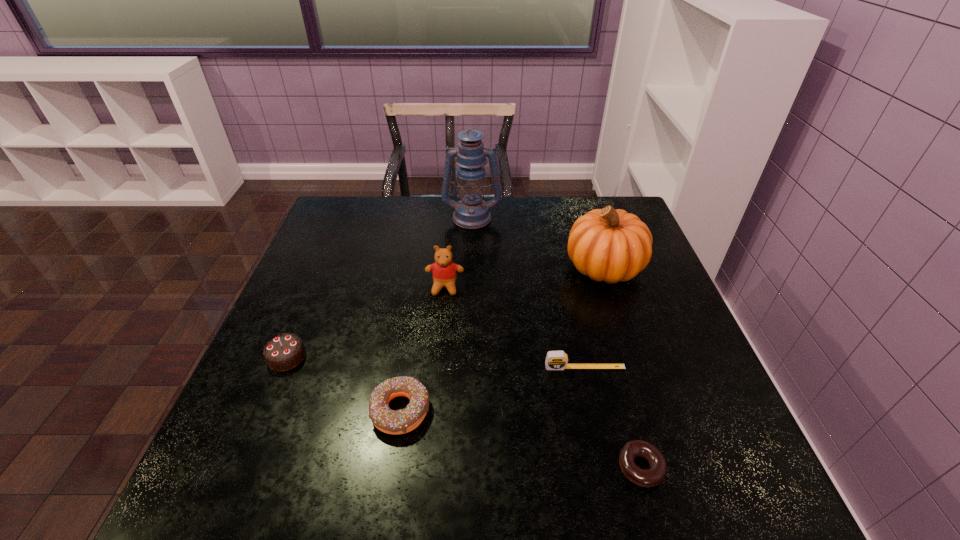
Where is `the farthest object`? The image size is (960, 540). the farthest object is located at coordinates (472, 212).

I want to click on lantern, so click(472, 212).

Find the location of a particular element. The width and height of the screenshot is (960, 540). the second tallest object is located at coordinates (609, 245).

Find the location of a particular element. This screenshot has width=960, height=540. the fifth shortest object is located at coordinates (444, 271).

Find the location of a particular element. the fourth tallest object is located at coordinates (284, 352).

At what (x,y) coordinates should I click in order to perform the action: click on chocolate cake. Please return your answer as a coordinate pair (x, y). Looking at the image, I should click on (x=284, y=352).

You are a GUI agent. You are given a task and a screenshot of the screen. Output one action in this format:
    pyautogui.click(x=<x>, y=<y>)
    Task: Click on the farther doughnut
    The image size is (960, 540).
    Given the screenshot: What is the action you would take?
    pyautogui.click(x=395, y=422)

At what (x,y) coordinates should I click in order to perform the action: click on the second nearest object. Please return your answer as a coordinate pair (x, y). This screenshot has height=540, width=960. Looking at the image, I should click on (395, 422).

Where is `tape measure`? Image resolution: width=960 pixels, height=540 pixels. tape measure is located at coordinates (555, 360).

Identify the location of the shorter doughnut. (654, 475).